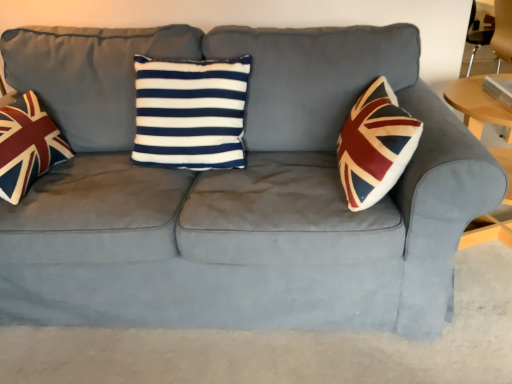
Where is `wooden round table at right`? wooden round table at right is located at coordinates (477, 105).

Measure the distance between union jack fabric pillow at left and camera.

The distance of union jack fabric pillow at left from camera is 4.19 feet.

At what (x,y) coordinates should I click in order to perform the action: click on wooden round table at right. Please return your answer as a coordinate pair (x, y). Looking at the image, I should click on pyautogui.click(x=477, y=105).

Based on the photo, is wooden round table at right wider than union jack fabric pillow at left?

Yes.

Locate an element on the screen. The image size is (512, 384). throw pillow that is above the wooden round table at right (from a real-world perspective) is located at coordinates [x=27, y=146].

Which is more to the right, wooden round table at right or union jack fabric pillow at left?

From the viewer's perspective, wooden round table at right appears more on the right side.

From the image's perspective, is wooden round table at right over union jack fabric pillow at left?

Actually, wooden round table at right appears below union jack fabric pillow at left in the image.

Is navy blue/white striped cushion at center surrounded by union jack fabric pillow at left?

No, navy blue/white striped cushion at center is located outside of union jack fabric pillow at left.

At what (x,y) coordinates should I click in order to perform the action: click on pillow that is behind the union jack fabric pillow at left. Please return your answer as a coordinate pair (x, y). Image resolution: width=512 pixels, height=384 pixels. Looking at the image, I should click on coord(191,113).

From a real-world perspective, is union jack fabric pillow at left located higher than navy blue/white striped cushion at center?

No.

From the image's perspective, is union jack fabric pillow at left positioned above or below navy blue/white striped cushion at center?

Based on their image positions, union jack fabric pillow at left is located beneath navy blue/white striped cushion at center.

From a real-world perspective, who is located lower, navy blue/white striped cushion at center or wooden round table at right?

In real-world perspective, wooden round table at right is lower.

Is navy blue/white striped cushion at center turned away from wooden round table at right?

navy blue/white striped cushion at center does not have its back to wooden round table at right.

Would you say navy blue/white striped cushion at center is inside or outside wooden round table at right?

navy blue/white striped cushion at center cannot be found inside wooden round table at right.

Based on the photo, does navy blue/white striped cushion at center have a greater width compared to wooden round table at right?

No, navy blue/white striped cushion at center is not wider than wooden round table at right.

Does wooden round table at right have a greater height compared to navy blue/white striped cushion at center?

Yes, wooden round table at right is taller than navy blue/white striped cushion at center.

Can you confirm if wooden round table at right is wider than navy blue/white striped cushion at center?

Yes, wooden round table at right is wider than navy blue/white striped cushion at center.

Could you tell me if wooden round table at right is facing navy blue/white striped cushion at center?

No, wooden round table at right is not facing towards navy blue/white striped cushion at center.

Locate an element on the screen. throw pillow located above the wooden round table at right (from the image's perspective) is located at coordinates (27, 146).

In the image, is union jack fabric pillow at left positioned in front of or behind wooden round table at right?

In the image, union jack fabric pillow at left appears in front of wooden round table at right.

Considering the relative sizes of union jack fabric pillow at left and wooden round table at right in the image provided, is union jack fabric pillow at left smaller than wooden round table at right?

Indeed, union jack fabric pillow at left has a smaller size compared to wooden round table at right.

How distant is union jack fabric pillow at left from wooden round table at right?

A distance of 4.78 feet exists between union jack fabric pillow at left and wooden round table at right.

From a real-world perspective, is navy blue/white striped cushion at center under union jack fabric pillow at left?

No.

How many degrees apart are the facing directions of navy blue/white striped cushion at center and union jack fabric pillow at left?

They differ by 89.9 degrees in their facing directions.

From the picture: Is union jack fabric pillow at left surrounded by navy blue/white striped cushion at center?

No, navy blue/white striped cushion at center does not contain union jack fabric pillow at left.

Considering the relative positions of navy blue/white striped cushion at center and union jack fabric pillow at left in the image provided, is navy blue/white striped cushion at center to the left or to the right of union jack fabric pillow at left?

navy blue/white striped cushion at center is to the right of union jack fabric pillow at left.

This screenshot has height=384, width=512. Identify the location of table behind the union jack fabric pillow at left. (477, 105).

You are a GUI agent. You are given a task and a screenshot of the screen. Output one action in this format:
    pyautogui.click(x=<x>, y=<y>)
    Task: Click on the throw pillow below the navy blue/white striped cushion at center (from a real-world perspective)
    Image resolution: width=512 pixels, height=384 pixels.
    Given the screenshot: What is the action you would take?
    pyautogui.click(x=27, y=146)

Estimate the real-world distances between objects in this image. Which object is further from wooden round table at right, union jack fabric pillow at left or navy blue/white striped cushion at center?

union jack fabric pillow at left.

Considering their positions, is wooden round table at right positioned closer to navy blue/white striped cushion at center than union jack fabric pillow at left?

union jack fabric pillow at left lies closer to navy blue/white striped cushion at center than the other object.

From the image, which object appears to be nearer to wooden round table at right, navy blue/white striped cushion at center or union jack fabric pillow at left?

The object closer to wooden round table at right is navy blue/white striped cushion at center.

When comparing their distances from navy blue/white striped cushion at center, does union jack fabric pillow at left or wooden round table at right seem further?

wooden round table at right.

Which object lies further to the anchor point union jack fabric pillow at left, navy blue/white striped cushion at center or wooden round table at right?

The object further to union jack fabric pillow at left is wooden round table at right.

Which object lies nearer to the anchor point union jack fabric pillow at left, wooden round table at right or navy blue/white striped cushion at center?

navy blue/white striped cushion at center.

Where is `pillow between union jack fabric pillow at left and wooden round table at right from left to right`? pillow between union jack fabric pillow at left and wooden round table at right from left to right is located at coordinates (191, 113).